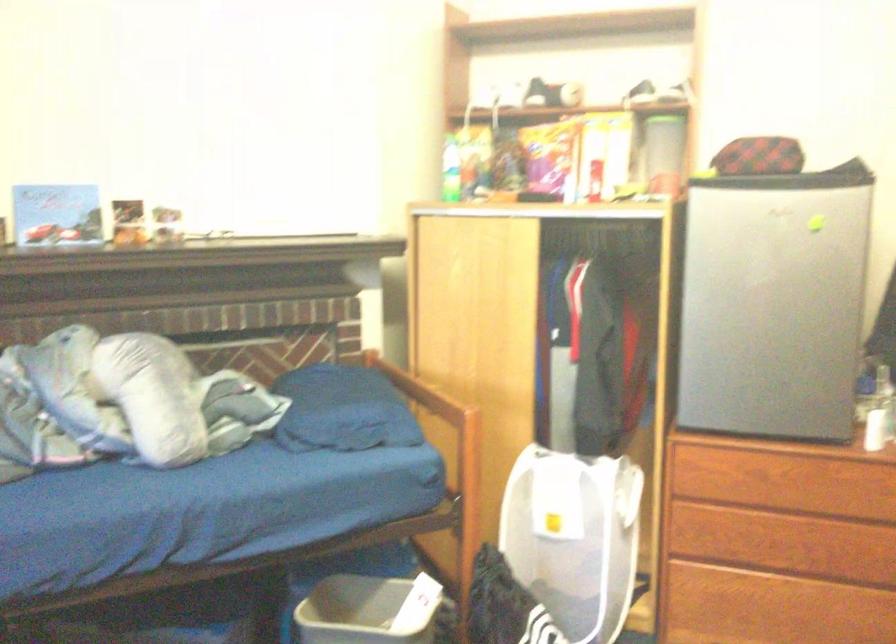
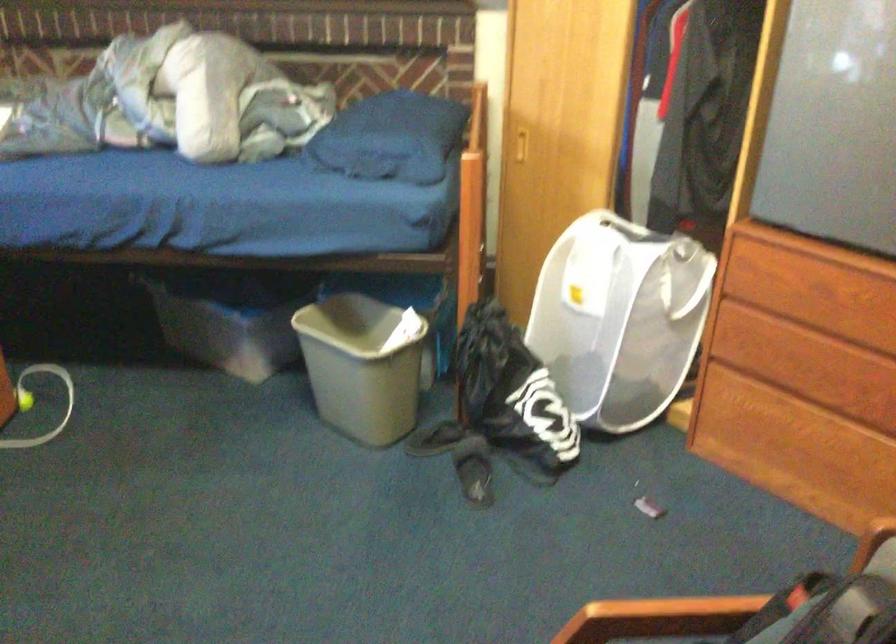
Locate, in the second image, the point that corresponds to (757,516) in the first image.

(808, 342)